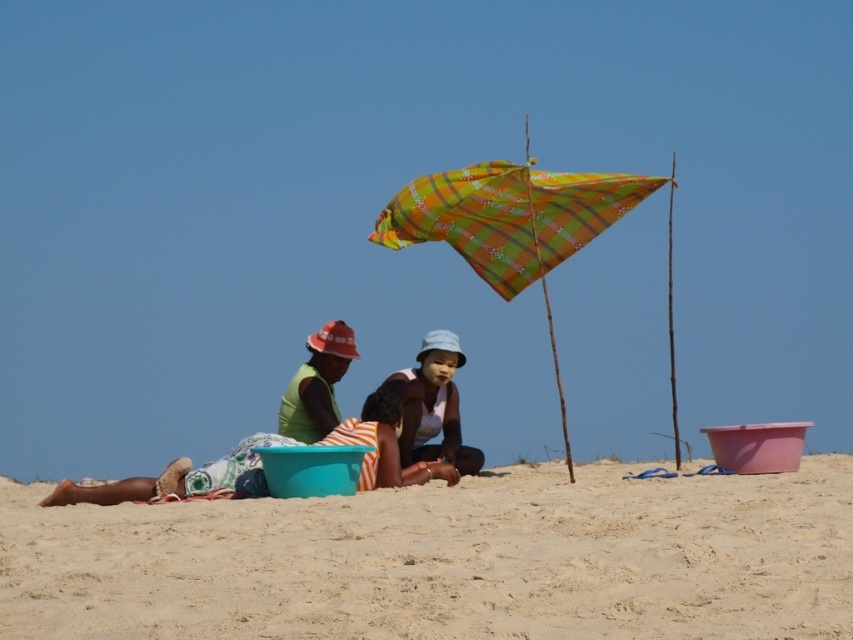
Based on the scene description, can you determine which object is closer to the viewer between the light blue fabric hat at center and the green fabric shirt at center?

The light blue fabric hat at center is in front of the green fabric shirt at center, so it is closer to the viewer.

You are standing at the center of the beach scene. There is a point at coordinates [433,404]. Which object from the scene does this point belong to?

The point at coordinates [433,404] is on the light blue fabric hat at center.